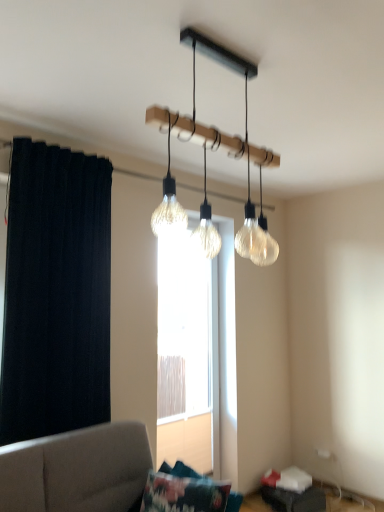
The height and width of the screenshot is (512, 384). What do you see at coordinates (228, 153) in the screenshot?
I see `clear glass light fixture at upper center` at bounding box center [228, 153].

Based on the photo, measure the distance between translucent glass window at center and camera.

The depth of translucent glass window at center is 3.18 meters.

The width and height of the screenshot is (384, 512). I want to click on fluffy fabric pillow at lower center, so click(183, 494).

Can you confirm if fluffy fabric pillow at lower center is positioned to the right of clear glass light fixture at upper center?

No.

How different are the orientations of fluffy fabric pillow at lower center and clear glass light fixture at upper center in degrees?

The angle between the facing direction of fluffy fabric pillow at lower center and the facing direction of clear glass light fixture at upper center is 85.9 degrees.

From a real-world perspective, is fluffy fabric pillow at lower center above or below clear glass light fixture at upper center?

fluffy fabric pillow at lower center is situated lower than clear glass light fixture at upper center in the real world.

Is fluffy fabric pillow at lower center bigger than clear glass light fixture at upper center?

Actually, fluffy fabric pillow at lower center might be smaller than clear glass light fixture at upper center.

Between point (80, 257) and point (142, 508), which one is positioned behind?

The point (80, 257) is farther from the camera.

Does dark fabric curtain at left turn towards fluffy fabric pillow at lower center?

Yes, dark fabric curtain at left is facing fluffy fabric pillow at lower center.

In the scene shown: Based on their sizes in the image, would you say dark fabric curtain at left is bigger or smaller than fluffy fabric pillow at lower center?

Clearly, dark fabric curtain at left is larger in size than fluffy fabric pillow at lower center.

This screenshot has height=512, width=384. Find the location of `curtain above the fluffy fabric pillow at lower center (from a real-world perspective)`. curtain above the fluffy fabric pillow at lower center (from a real-world perspective) is located at coordinates (56, 293).

Is dark fabric curtain at left bigger or smaller than translucent glass window at center?

Clearly, dark fabric curtain at left is smaller in size than translucent glass window at center.

Consider the image. Is dark fabric curtain at left positioned with its back to translucent glass window at center?

No, dark fabric curtain at left is not facing the opposite direction of translucent glass window at center.

Measure the distance between dark fabric curtain at left and translucent glass window at center.

dark fabric curtain at left and translucent glass window at center are 4.16 feet apart from each other.

Find the location of `window to the right of dark fabric curtain at left`. window to the right of dark fabric curtain at left is located at coordinates (197, 354).

Is clear glass light fixture at upper center facing towards translucent glass window at center?

No, clear glass light fixture at upper center is not turned towards translucent glass window at center.

Would you consider clear glass light fixture at upper center to be distant from translucent glass window at center?

clear glass light fixture at upper center is positioned a significant distance from translucent glass window at center.

Choose the correct answer: Is clear glass light fixture at upper center inside translucent glass window at center or outside it?

clear glass light fixture at upper center exists outside the volume of translucent glass window at center.

From the image's perspective, between clear glass light fixture at upper center and translucent glass window at center, which one is located above?

clear glass light fixture at upper center.

Would you say translucent glass window at center is inside or outside dark fabric curtain at left?

translucent glass window at center is not enclosed by dark fabric curtain at left.

From the image's perspective, between translucent glass window at center and dark fabric curtain at left, which one is located above?

dark fabric curtain at left appears higher in the image.

Is translucent glass window at center facing towards dark fabric curtain at left?

No, translucent glass window at center is not oriented towards dark fabric curtain at left.

From the picture: Does dark fabric curtain at left contain clear glass light fixture at upper center?

No, clear glass light fixture at upper center is located outside of dark fabric curtain at left.

Looking at this image, relative to clear glass light fixture at upper center, is dark fabric curtain at left in front or behind?

dark fabric curtain at left is behind clear glass light fixture at upper center.

How much distance is there between dark fabric curtain at left and clear glass light fixture at upper center?

dark fabric curtain at left and clear glass light fixture at upper center are 1.25 meters apart.

From a real-world perspective, is translucent glass window at center located higher than fluffy fabric pillow at lower center?

Indeed, from a real-world perspective, translucent glass window at center stands above fluffy fabric pillow at lower center.

Between translucent glass window at center and fluffy fabric pillow at lower center, which one has smaller size?

fluffy fabric pillow at lower center.

Considering the relative positions of translucent glass window at center and fluffy fabric pillow at lower center in the image provided, is translucent glass window at center in front of fluffy fabric pillow at lower center?

No, the depth of translucent glass window at center is greater than that of fluffy fabric pillow at lower center.

Find the location of a particular element. lamp in front of the fluffy fabric pillow at lower center is located at coordinates (228, 153).

Where is `curtain behind the fluffy fabric pillow at lower center`? curtain behind the fluffy fabric pillow at lower center is located at coordinates (56, 293).

Which object lies further to the anchor point clear glass light fixture at upper center, translucent glass window at center or fluffy fabric pillow at lower center?

The object further to clear glass light fixture at upper center is translucent glass window at center.

Looking at the image, which one is located closer to fluffy fabric pillow at lower center, translucent glass window at center or clear glass light fixture at upper center?

Among the two, translucent glass window at center is located nearer to fluffy fabric pillow at lower center.

Based on their spatial positions, is translucent glass window at center or clear glass light fixture at upper center closer to dark fabric curtain at left?

clear glass light fixture at upper center lies closer to dark fabric curtain at left than the other object.

Looking at the image, which one is located further to fluffy fabric pillow at lower center, clear glass light fixture at upper center or dark fabric curtain at left?

clear glass light fixture at upper center.

Which object lies further to the anchor point clear glass light fixture at upper center, dark fabric curtain at left or translucent glass window at center?

translucent glass window at center is positioned further to the anchor clear glass light fixture at upper center.

Looking at the image, which one is located further to translucent glass window at center, dark fabric curtain at left or clear glass light fixture at upper center?

clear glass light fixture at upper center is positioned further to the anchor translucent glass window at center.

From the image, which object appears to be farther from fluffy fabric pillow at lower center, dark fabric curtain at left or translucent glass window at center?

The object further to fluffy fabric pillow at lower center is translucent glass window at center.

In the scene shown: From the image, which object appears to be nearer to dark fabric curtain at left, translucent glass window at center or fluffy fabric pillow at lower center?

fluffy fabric pillow at lower center.

Locate an element on the screen. This screenshot has height=512, width=384. pillow between clear glass light fixture at upper center and translucent glass window at center in the front-back direction is located at coordinates (183, 494).

You are a GUI agent. You are given a task and a screenshot of the screen. Output one action in this format:
    pyautogui.click(x=<x>, y=<y>)
    Task: Click on the curtain between clear glass light fixture at upper center and fluffy fabric pillow at lower center in the vertical direction
    
    Given the screenshot: What is the action you would take?
    pyautogui.click(x=56, y=293)

Locate an element on the screen. Image resolution: width=384 pixels, height=512 pixels. curtain between clear glass light fixture at upper center and translucent glass window at center from front to back is located at coordinates (56, 293).

At what (x,y) coordinates should I click in order to perform the action: click on curtain positioned between fluffy fabric pillow at lower center and translucent glass window at center from near to far. Please return your answer as a coordinate pair (x, y). Image resolution: width=384 pixels, height=512 pixels. Looking at the image, I should click on (56, 293).